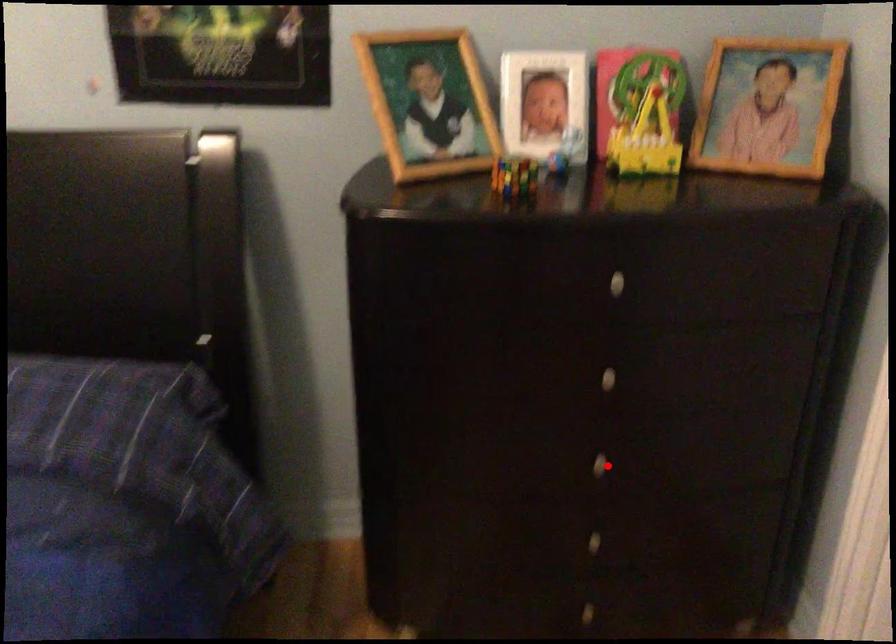
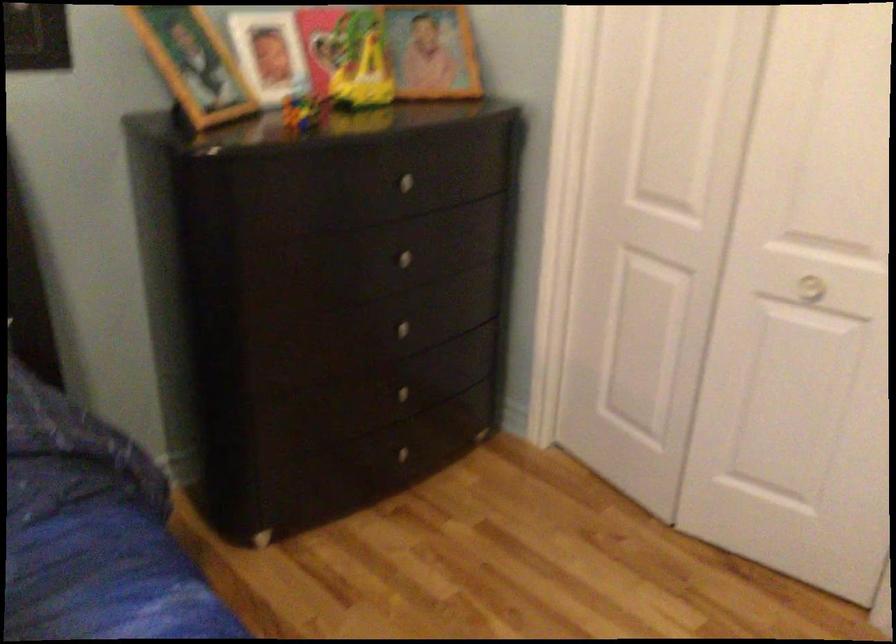
In the second image, find the point that corresponds to the highlighted location in the first image.

(409, 332)